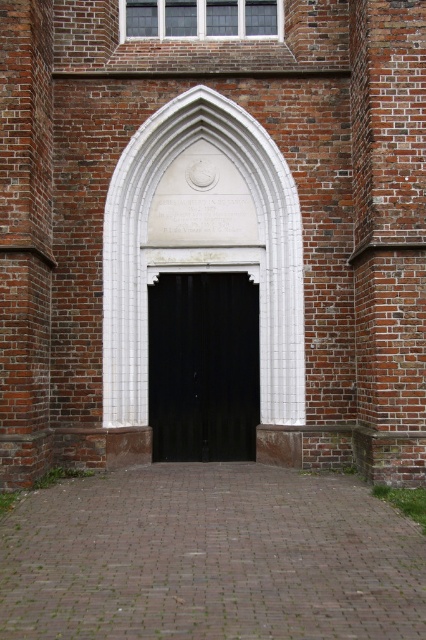
Is point (290, 312) positioned after point (241, 321)?

That is False.

Where is `white stone archway at center`? The image size is (426, 640). white stone archway at center is located at coordinates (255, 275).

The width and height of the screenshot is (426, 640). Identify the location of white stone archway at center. click(x=255, y=275).